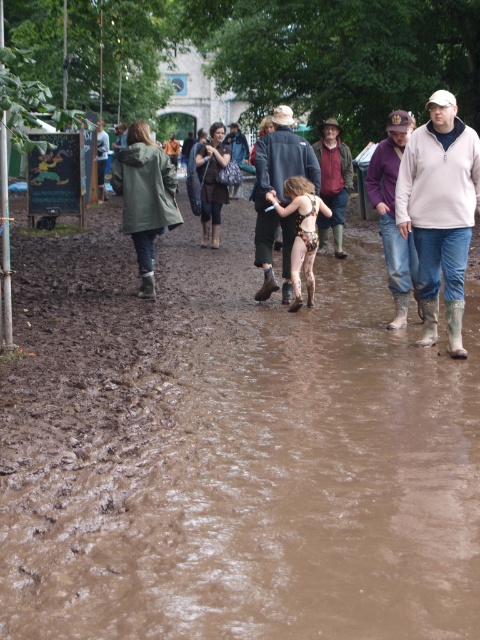
Is light beige sweater at center further to camera compared to printed fabric bikini at center?

No, light beige sweater at center is closer to the viewer.

Who is more forward, [459,298] or [312,296]?

Positioned in front is point [459,298].

Who is more forward, (x=444, y=252) or (x=297, y=252)?

Point (x=444, y=252) is more forward.

You are a GUI agent. You are given a task and a screenshot of the screen. Output one action in this format:
    pyautogui.click(x=<x>, y=<y>)
    Task: Click on the light beige sweater at center
    
    Given the screenshot: What is the action you would take?
    pyautogui.click(x=440, y=211)

Between green matte coat at center and purple fleece jacket at upper right, which one is positioned lower?

purple fleece jacket at upper right

Can you confirm if green matte coat at center is positioned to the right of purple fleece jacket at upper right?

Incorrect, green matte coat at center is not on the right side of purple fleece jacket at upper right.

Between point (153, 259) and point (406, 243), which one is positioned in front?

Positioned in front is point (406, 243).

Locate an element on the screen. The width and height of the screenshot is (480, 640). green matte coat at center is located at coordinates (144, 196).

Does metallic gold bikini at center have a lesser width compared to printed fabric bikini at center?

Yes, metallic gold bikini at center is thinner than printed fabric bikini at center.

Between metallic gold bikini at center and printed fabric bikini at center, which one appears on the left side from the viewer's perspective?

metallic gold bikini at center

Which is in front, point (285, 156) or point (286, 212)?

Point (286, 212)

The image size is (480, 640). I want to click on metallic gold bikini at center, so click(x=277, y=195).